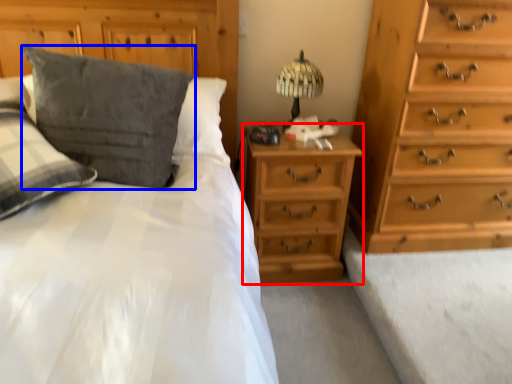
Question: Which point is closer to the camera, nightstand (highlighted by a red box) or pillow (highlighted by a blue box)?

Choices:
 (A) nightstand
 (B) pillow

Answer: (B)